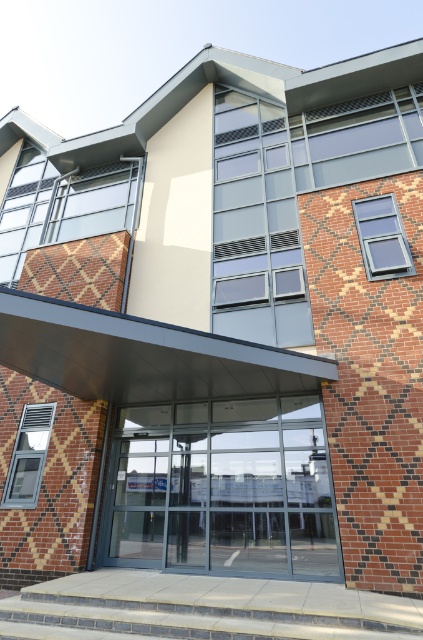
Question: Which of the following is the closest to the observer?

Choices:
 (A) coord(241,532)
 (B) coord(148,636)

Answer: (B)

Question: Is transparent glass door at center to the left of gray concrete stairs at lower center from the viewer's perspective?

Choices:
 (A) yes
 (B) no

Answer: (B)

Question: Does transparent glass door at center appear under gray concrete stairs at lower center?

Choices:
 (A) yes
 (B) no

Answer: (B)

Question: Is the position of transparent glass door at center more distant than that of gray concrete stairs at lower center?

Choices:
 (A) no
 (B) yes

Answer: (B)

Question: Which object is closer to the camera taking this photo?

Choices:
 (A) gray concrete stairs at lower center
 (B) transparent glass door at center

Answer: (A)

Question: Which object is farther from the camera taking this photo?

Choices:
 (A) gray concrete stairs at lower center
 (B) transparent glass door at center

Answer: (B)